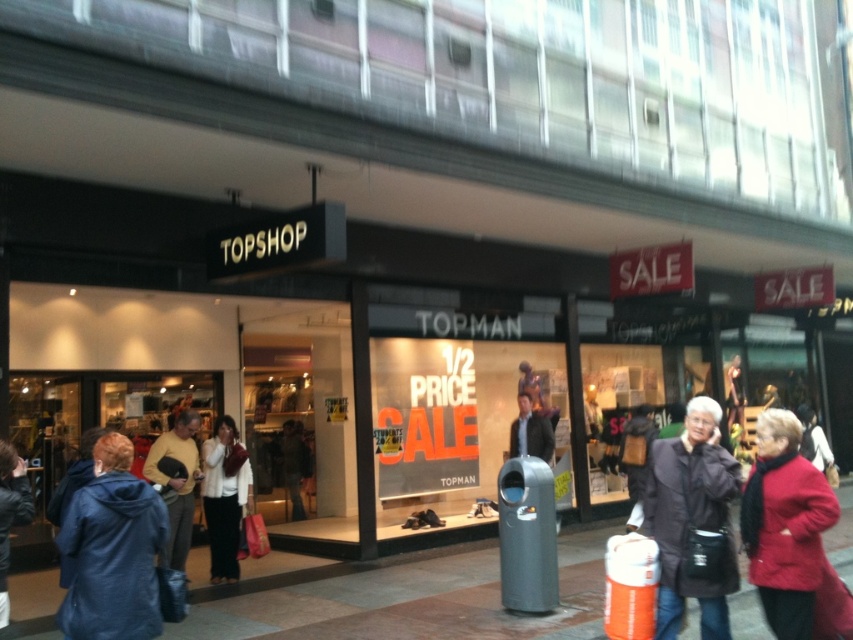
Question: Considering the relative positions of red woolen coat at center and dark brown leather jacket at center in the image provided, where is red woolen coat at center located with respect to dark brown leather jacket at center?

Choices:
 (A) above
 (B) below

Answer: (A)

Question: Which object is closer to the camera taking this photo?

Choices:
 (A) white fabric jacket at center
 (B) yellow sweater at center
 (C) blue hooded jacket at lower left
 (D) dark brown leather jacket at center

Answer: (C)

Question: Can you confirm if concrete pavement at center is wider than yellow sweater at center?

Choices:
 (A) yes
 (B) no

Answer: (A)

Question: Considering the real-world distances, which object is farthest from the blue hooded jacket at lower left?

Choices:
 (A) red woolen coat at center
 (B) concrete pavement at center
 (C) dark brown leather jacket at center

Answer: (C)

Question: Among these points, which one is nearest to the camera?

Choices:
 (A) coord(711,588)
 (B) coord(228,541)
 (C) coord(389,604)

Answer: (A)

Question: Is concrete pavement at center closer to camera compared to yellow sweater at center?

Choices:
 (A) no
 (B) yes

Answer: (B)